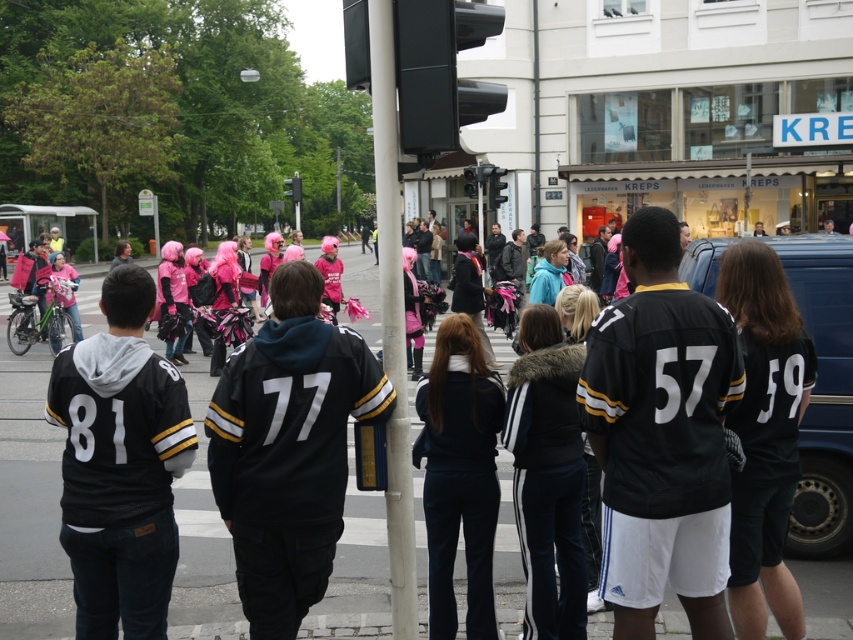
What do you see at coordinates (459, 476) in the screenshot?
I see `dark blue fleece jacket at center` at bounding box center [459, 476].

Can you confirm if dark blue fleece jacket at center is positioned above matte pink helmet at left?

Incorrect, dark blue fleece jacket at center is not positioned above matte pink helmet at left.

Between point (466, 544) and point (42, 339), which one is positioned in front?

Positioned in front is point (466, 544).

Find the location of a particular element. dark blue fleece jacket at center is located at coordinates (459, 476).

Between black leather jacket at center and matte pink helmet at left, which one appears on the left side from the viewer's perspective?

Positioned to the left is matte pink helmet at left.

Does black leather jacket at center have a lesser width compared to matte pink helmet at left?

Correct, black leather jacket at center's width is less than matte pink helmet at left's.

Is point (285, 298) closer to viewer compared to point (27, 262)?

Yes, point (285, 298) is closer to viewer.

Where is `black leather jacket at center`? Image resolution: width=853 pixels, height=640 pixels. black leather jacket at center is located at coordinates (288, 449).

How distant is black leather jacket at center from dark blue fleece jacket at center?

black leather jacket at center is 36.37 inches from dark blue fleece jacket at center.

Who is higher up, black leather jacket at center or dark blue fleece jacket at center?

black leather jacket at center

Describe the element at coordinates (288, 449) in the screenshot. Image resolution: width=853 pixels, height=640 pixels. I see `black leather jacket at center` at that location.

Find the location of a particular element. black leather jacket at center is located at coordinates (288, 449).